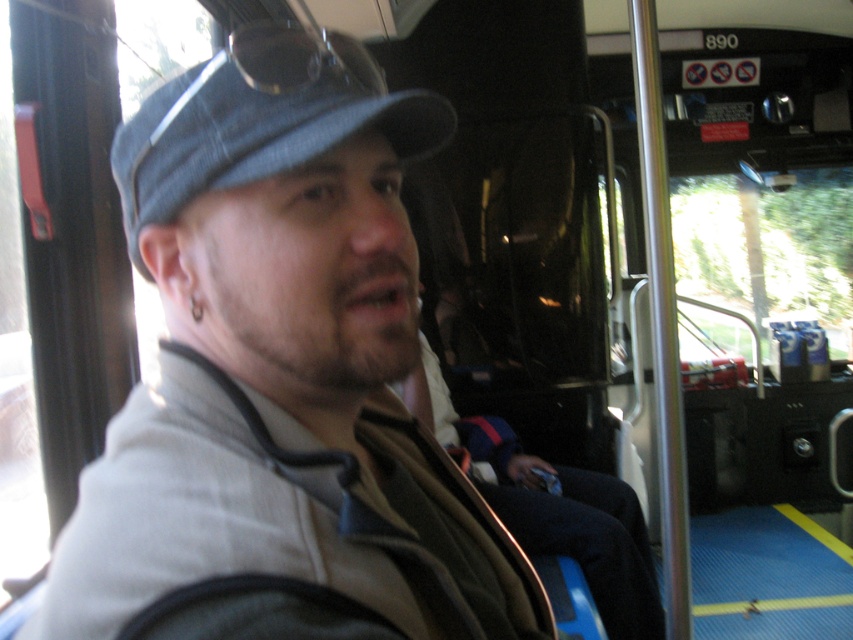
Can you confirm if denim baseball cap at center is smaller than dark blue fabric jacket at center?

Yes, denim baseball cap at center is smaller than dark blue fabric jacket at center.

Is point (134, 240) positioned after point (634, 628)?

No, it is not.

This screenshot has width=853, height=640. Find the location of `denim baseball cap at center`. denim baseball cap at center is located at coordinates (260, 120).